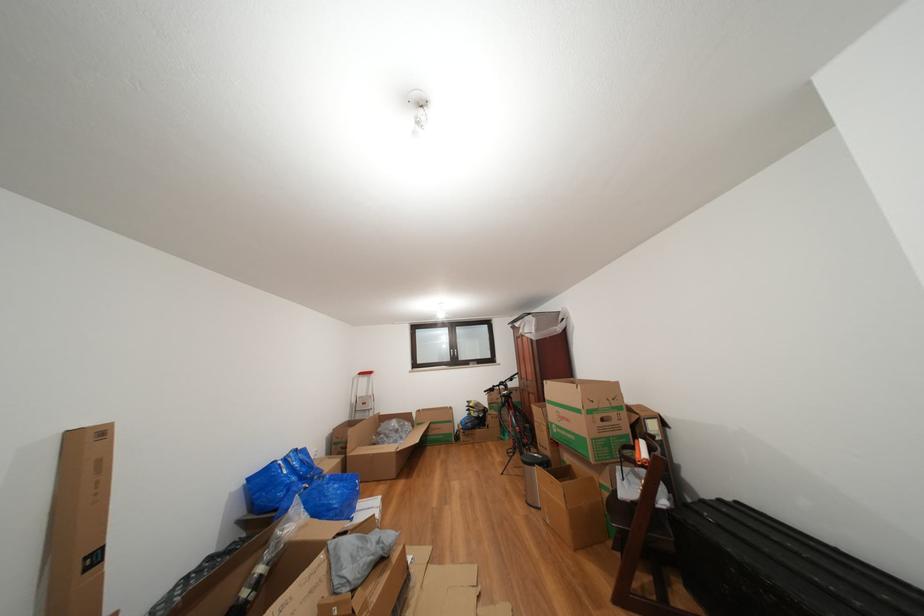
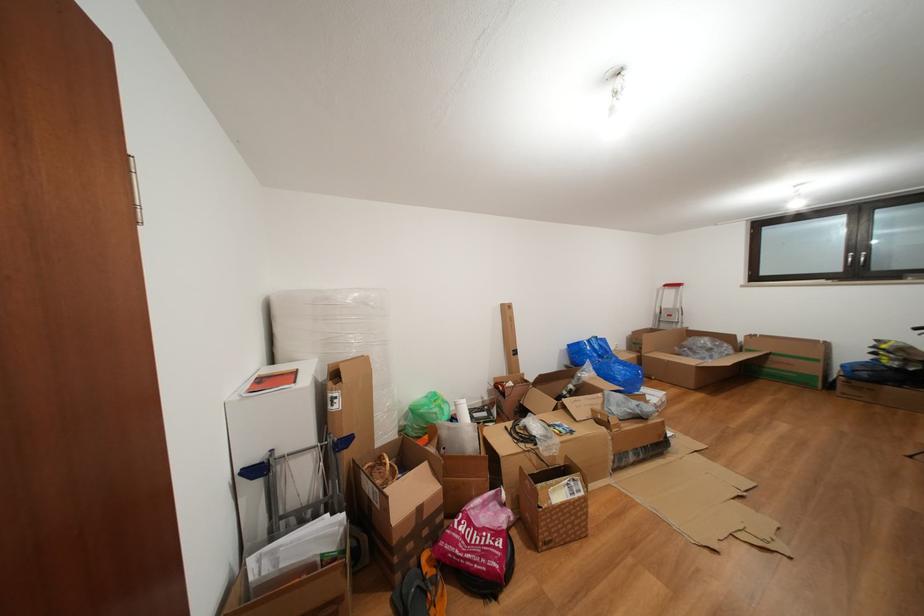
Locate, in the second image, the point that corresponds to (462,351) in the first image.

(866, 252)